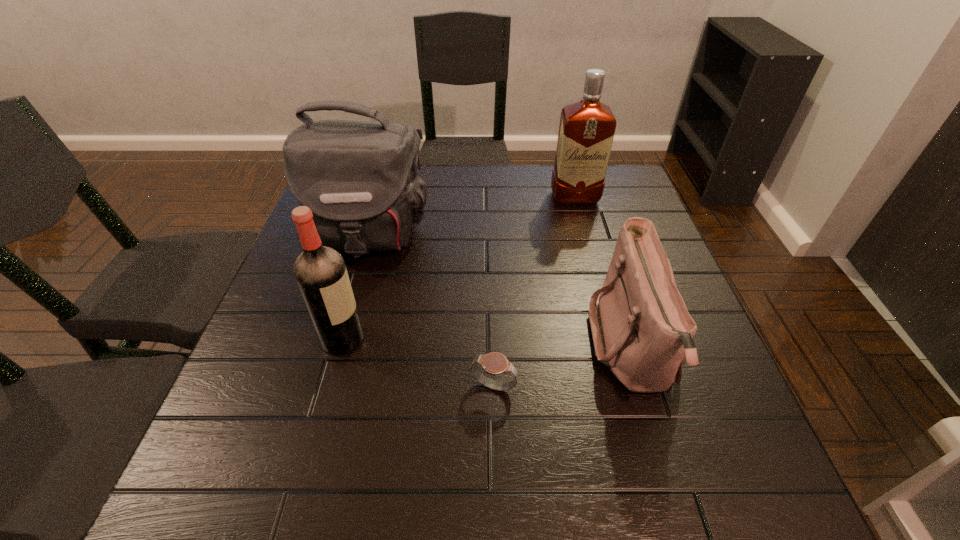
In order to click on the farther liquor in this screenshot , I will do `click(586, 131)`.

This screenshot has width=960, height=540. I want to click on the left shoulder bag, so pyautogui.click(x=360, y=179).

This screenshot has width=960, height=540. What are the coordinates of `the farther shoulder bag` in the screenshot? It's located at (360, 179).

I want to click on the nearer liquor, so [x=320, y=271].

Find the location of a particular element. The width and height of the screenshot is (960, 540). the nearer shoulder bag is located at coordinates (641, 328).

Where is `the right shoulder bag`? The width and height of the screenshot is (960, 540). the right shoulder bag is located at coordinates (641, 328).

What are the coordinates of `watch` in the screenshot? It's located at (494, 363).

Image resolution: width=960 pixels, height=540 pixels. I want to click on the shortest object, so click(x=494, y=363).

Find the location of a particular element. This screenshot has width=960, height=540. vacant space located on the front label of the right liquor is located at coordinates (596, 275).

I want to click on free location located 0.100m on the open flap of the left shoulder bag, so click(348, 304).